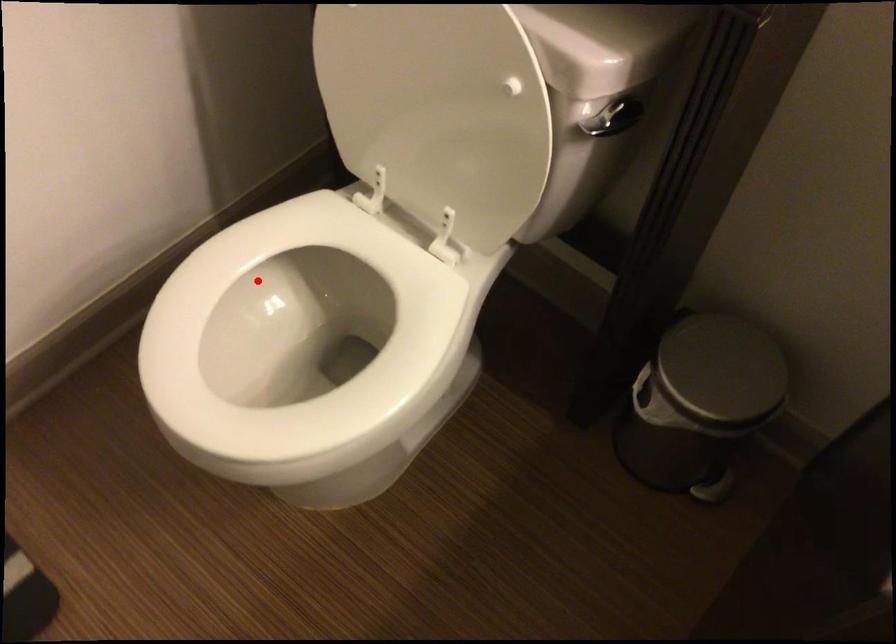
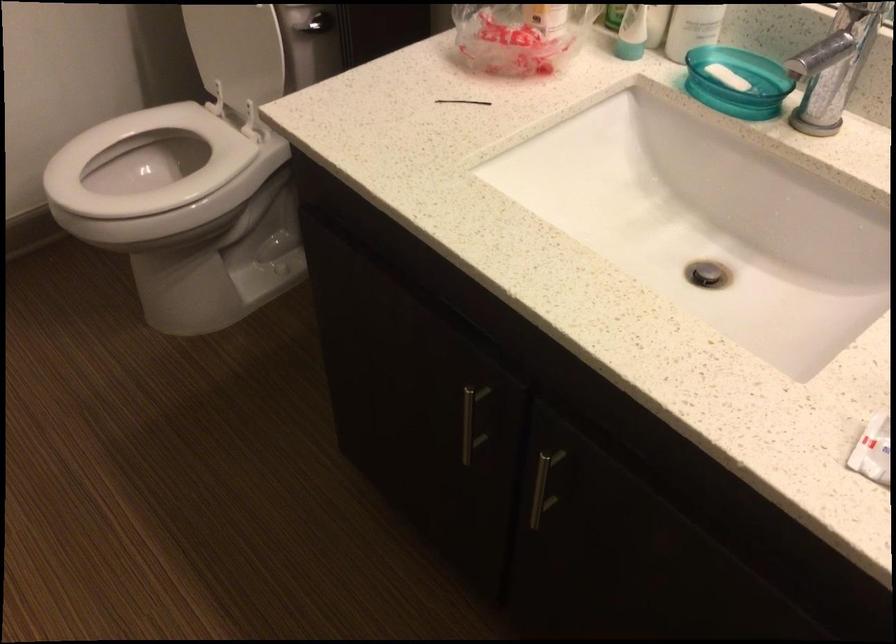
Question: I am providing you with two images of the same scene from different viewpoints. A red point is shown in image1. For the corresponding object point in image2, is it positioned nearer or farther from the camera?

Choices:
 (A) Nearer
 (B) Farther

Answer: (B)